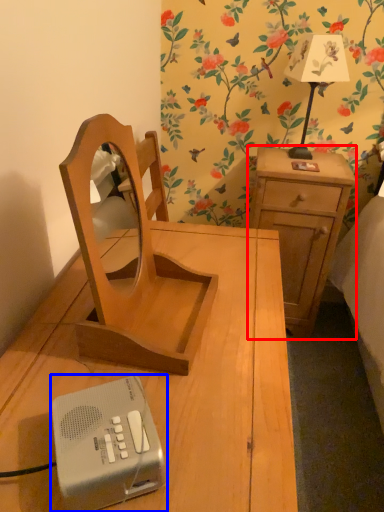
Question: Which of the following is the farthest to the observer, nightstand (highlighted by a red box) or gadget (highlighted by a blue box)?

Choices:
 (A) nightstand
 (B) gadget

Answer: (A)